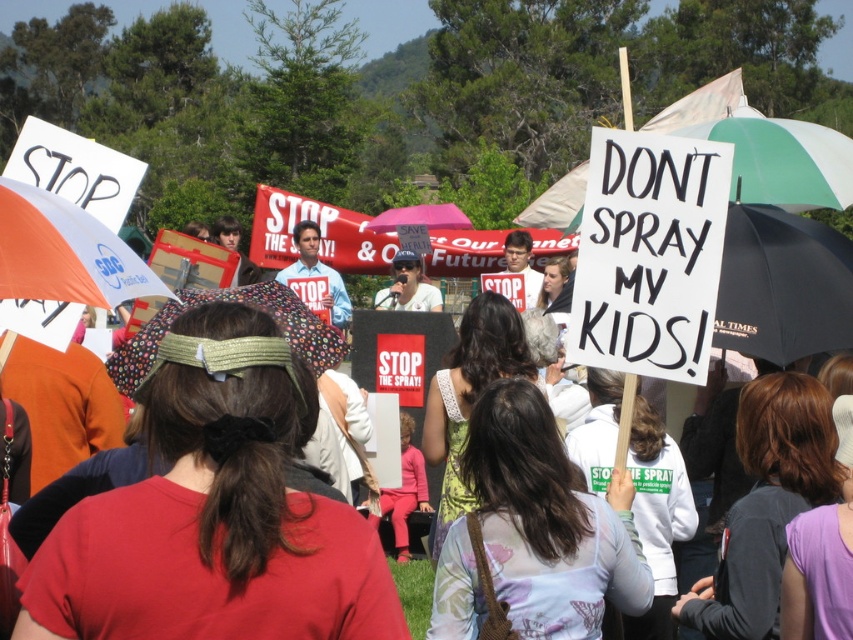
Does orange fabric umbrella at upper left have a larger size compared to floral fabric umbrella at center?

Indeed, orange fabric umbrella at upper left has a larger size compared to floral fabric umbrella at center.

Is orange fabric umbrella at upper left to the right of floral fabric umbrella at center from the viewer's perspective?

In fact, orange fabric umbrella at upper left is to the left of floral fabric umbrella at center.

Which is behind, point (148, 282) or point (202, 298)?

Positioned behind is point (202, 298).

Find the location of a particular element. orange fabric umbrella at upper left is located at coordinates click(62, 252).